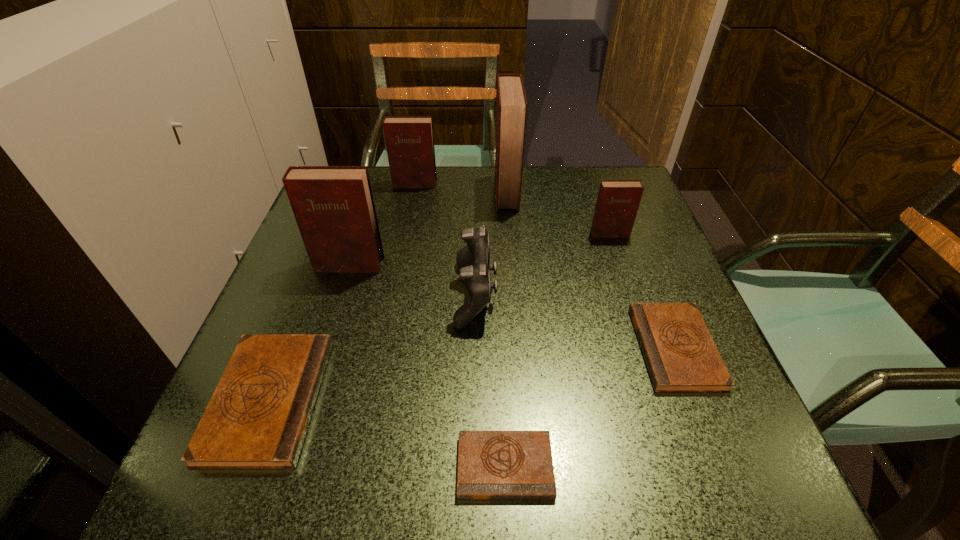
Find the location of a particular element. This screenshot has height=540, width=960. vacant space located 0.210m on the front cover of the smallest reddish-brown diary is located at coordinates (634, 305).

Locate an element on the screen. Image resolution: width=960 pixels, height=540 pixels. free region located on the surface of the control with buttons is located at coordinates (577, 294).

Image resolution: width=960 pixels, height=540 pixels. Identify the location of vacant space positioned on the spine side of the biggest brown diary. [495, 399].

This screenshot has width=960, height=540. I want to click on free location located on the spine side of the seventh tallest object, so click(x=534, y=348).

Find the location of a particular element. vacant space located 0.240m on the spine side of the seventh tallest object is located at coordinates (506, 348).

Locate an element on the screen. The width and height of the screenshot is (960, 540). vacant region located 0.080m on the spine side of the seventh tallest object is located at coordinates (595, 348).

The height and width of the screenshot is (540, 960). I want to click on object present at the near left corner, so click(257, 418).

At what (x,y) coordinates should I click in order to perform the action: click on blank space at the far edge of the desktop. Please return your answer as a coordinate pair (x, y). Looking at the image, I should click on (411, 194).

Image resolution: width=960 pixels, height=540 pixels. Identify the location of free space at the near edge. (355, 449).

In the image, there is a desktop. Where is `vacant space at the left edge`? This screenshot has height=540, width=960. vacant space at the left edge is located at coordinates (338, 283).